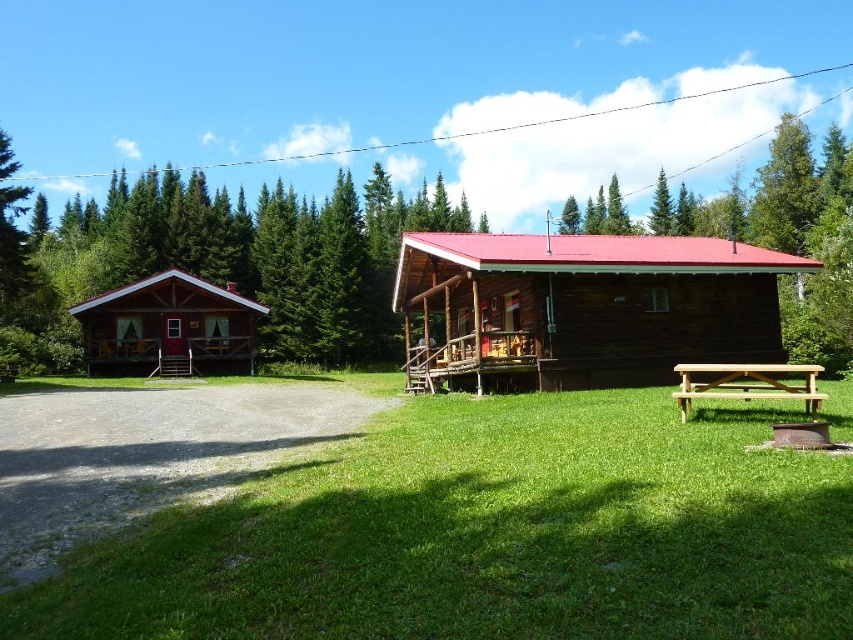
Is light brown wooden picnic table at lower right to the right of green textured pine tree at upper center from the viewer's perspective?

Incorrect, light brown wooden picnic table at lower right is not on the right side of green textured pine tree at upper center.

Who is lower down, light brown wooden picnic table at lower right or green textured pine tree at upper center?

light brown wooden picnic table at lower right is below.

This screenshot has height=640, width=853. Describe the element at coordinates (747, 385) in the screenshot. I see `light brown wooden picnic table at lower right` at that location.

Identify the location of light brown wooden picnic table at lower right. The image size is (853, 640). (747, 385).

Does wooden cabin at left have a lesser height compared to green textured pine tree at upper center?

Yes, wooden cabin at left is shorter than green textured pine tree at upper center.

Can you confirm if wooden cabin at left is positioned to the right of green textured pine tree at upper center?

No, wooden cabin at left is not to the right of green textured pine tree at upper center.

Is point (157, 358) positioned after point (654, 192)?

No, (157, 358) is in front of (654, 192).

The width and height of the screenshot is (853, 640). Find the location of `wooden cabin at left`. wooden cabin at left is located at coordinates (169, 326).

Is brown wooden cabin at center thinner than wooden cabin at left?

Yes, brown wooden cabin at center is thinner than wooden cabin at left.

Does point (599, 368) lie behind point (90, 307)?

No, it is not.

Find the location of a particular element. This screenshot has height=640, width=853. brown wooden cabin at center is located at coordinates (589, 305).